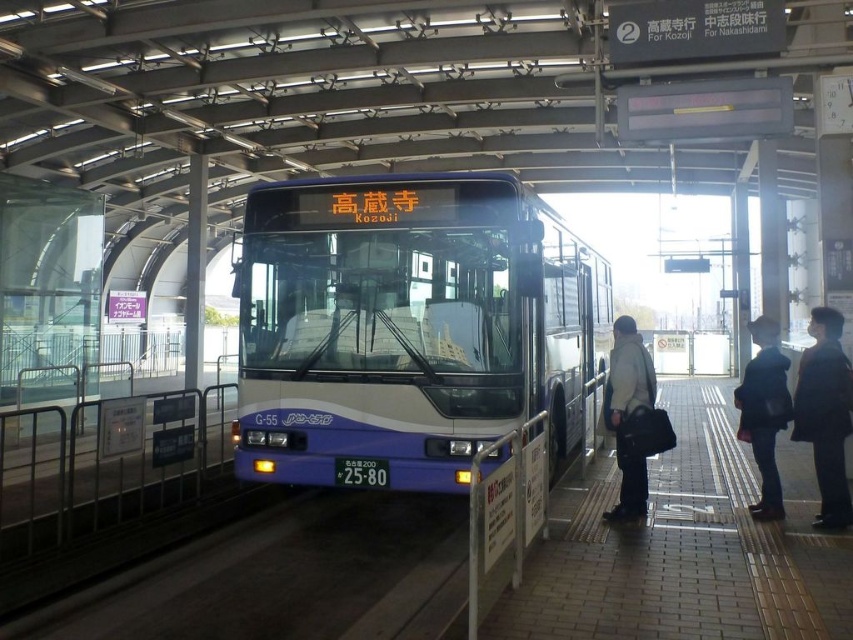
You are a passenger waiting at the bus station and need to board the bus. You have a 30 cm wide backpack. There is a black fabric coat at right and a dark blue jacket at right. Can your backpack fit between them?

The distance between the black fabric coat at right and the dark blue jacket at right is 36.19 centimeters. Since your backpack is 30 cm wide, it should fit between them as the space is wider than the backpack.

You are a traveler who just arrived at the bus station and need to find your dark blue jacket at right. According to the scene description, where should you look for it?

The dark blue jacket at right is located at point (764, 412).